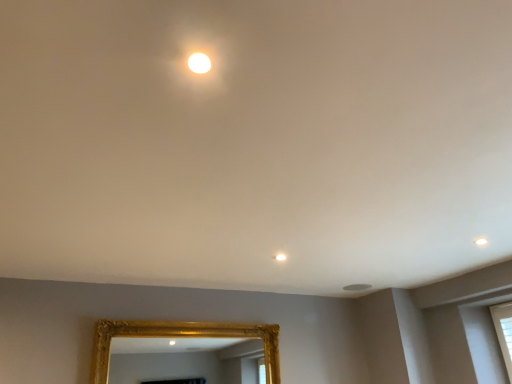
The height and width of the screenshot is (384, 512). Describe the element at coordinates (481, 241) in the screenshot. I see `matte white light at upper center` at that location.

Find the location of a particular element. This screenshot has width=512, height=384. matte white light at upper center is located at coordinates (481, 241).

Describe the element at coordinates (185, 359) in the screenshot. I see `gold textured mirror at lower center` at that location.

Find the location of a particular element. Image resolution: width=512 pixels, height=384 pixels. gold textured mirror at lower center is located at coordinates (185, 359).

Find the location of a particular element. The height and width of the screenshot is (384, 512). matte white light at upper center is located at coordinates (481, 241).

Between gold textured mirror at lower center and matte white light at upper center, which one appears on the right side from the viewer's perspective?

matte white light at upper center.

Considering their positions, is gold textured mirror at lower center located in front of or behind matte white light at upper center?

gold textured mirror at lower center is positioned farther from the viewer than matte white light at upper center.

Between point (193, 374) and point (482, 243), which one is positioned in front?

The point (482, 243) is more forward.

From the image's perspective, is gold textured mirror at lower center on matte white light at upper center?

Actually, gold textured mirror at lower center appears below matte white light at upper center in the image.

From a real-world perspective, is gold textured mirror at lower center beneath matte white light at upper center?

Yes, from a real-world perspective, gold textured mirror at lower center is under matte white light at upper center.

Which object is wider, gold textured mirror at lower center or matte white light at upper center?

Wider between the two is gold textured mirror at lower center.

In the scene shown: Does gold textured mirror at lower center have a lesser height compared to matte white light at upper center?

Incorrect, the height of gold textured mirror at lower center does not fall short of that of matte white light at upper center.

Who is bigger, gold textured mirror at lower center or matte white light at upper center?

gold textured mirror at lower center.

Is gold textured mirror at lower center inside or outside of matte white light at upper center?

gold textured mirror at lower center is not enclosed by matte white light at upper center.

Is gold textured mirror at lower center next to matte white light at upper center and touching it?

gold textured mirror at lower center is not next to matte white light at upper center, and they're not touching.

Is gold textured mirror at lower center looking in the opposite direction of matte white light at upper center?

That's not correct — gold textured mirror at lower center is not looking away from matte white light at upper center.

Can you tell me how much gold textured mirror at lower center and matte white light at upper center differ in facing direction?

The angle between the facing direction of gold textured mirror at lower center and the facing direction of matte white light at upper center is 180 degrees.

How far apart are gold textured mirror at lower center and matte white light at upper center?

gold textured mirror at lower center is 3.27 meters away from matte white light at upper center.

You are a GUI agent. You are given a task and a screenshot of the screen. Output one action in this format:
    pyautogui.click(x=<x>, y=<y>)
    Task: Click on the mirror below the matte white light at upper center (from the image's perspective)
    Image resolution: width=512 pixels, height=384 pixels.
    Given the screenshot: What is the action you would take?
    [x=185, y=359]

Visually, is matte white light at upper center positioned to the left or to the right of gold textured mirror at lower center?

From the image, it's evident that matte white light at upper center is to the right of gold textured mirror at lower center.

From the picture: Is the position of matte white light at upper center less distant than that of gold textured mirror at lower center?

Yes, the depth of matte white light at upper center is less than that of gold textured mirror at lower center.

Between point (481, 238) and point (241, 368), which one is positioned behind?

The point (241, 368) is more distant.

From the image's perspective, is matte white light at upper center beneath gold textured mirror at lower center?

No, from the image's perspective, matte white light at upper center is not beneath gold textured mirror at lower center.

From a real-world perspective, is matte white light at upper center positioned under gold textured mirror at lower center based on gravity?

No, from a real-world perspective, matte white light at upper center is not beneath gold textured mirror at lower center.

Consider the image. Does matte white light at upper center have a lesser width compared to gold textured mirror at lower center?

Yes.

Which of these two, matte white light at upper center or gold textured mirror at lower center, stands shorter?

With less height is matte white light at upper center.

Does matte white light at upper center have a larger size compared to gold textured mirror at lower center?

Incorrect, matte white light at upper center is not larger than gold textured mirror at lower center.

Is matte white light at upper center positioned beyond the bounds of gold textured mirror at lower center?

Absolutely, matte white light at upper center is external to gold textured mirror at lower center.

Is matte white light at upper center directly adjacent to gold textured mirror at lower center?

There is a gap between matte white light at upper center and gold textured mirror at lower center.

Is matte white light at upper center turned away from gold textured mirror at lower center?

No, matte white light at upper center's orientation is not away from gold textured mirror at lower center.

What's the angular difference between matte white light at upper center and gold textured mirror at lower center's facing directions?

The angle between the facing direction of matte white light at upper center and the facing direction of gold textured mirror at lower center is 180 degrees.

At what (x,y) coordinates should I click in order to perform the action: click on light that appears on the right of gold textured mirror at lower center. Please return your answer as a coordinate pair (x, y). The image size is (512, 384). Looking at the image, I should click on (481, 241).

This screenshot has height=384, width=512. I want to click on mirror directly beneath the matte white light at upper center (from a real-world perspective), so click(x=185, y=359).

Find the location of `mirror located on the left of matte white light at upper center`. mirror located on the left of matte white light at upper center is located at coordinates (185, 359).